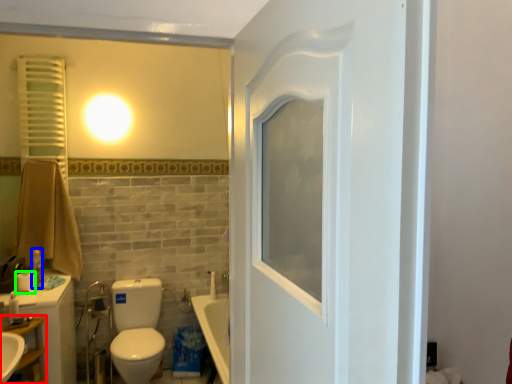
Question: Which object is the farthest from shelf (highlighted by a red box)? Choose among these: toiletry (highlighted by a blue box) or toilet paper (highlighted by a green box).

Choices:
 (A) toiletry
 (B) toilet paper

Answer: (A)